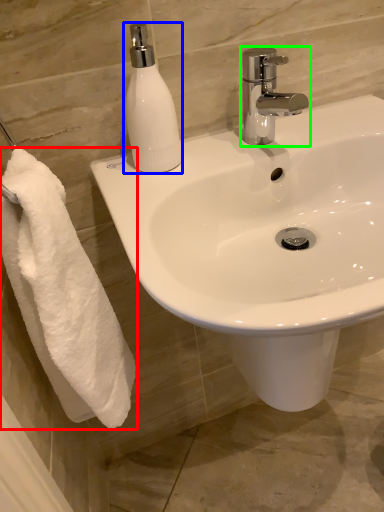
Question: Considering the real-world distances, which object is farthest from towel (highlighted by a red box)? soap dispenser (highlighted by a blue box) or tap (highlighted by a green box)?

Choices:
 (A) soap dispenser
 (B) tap

Answer: (B)